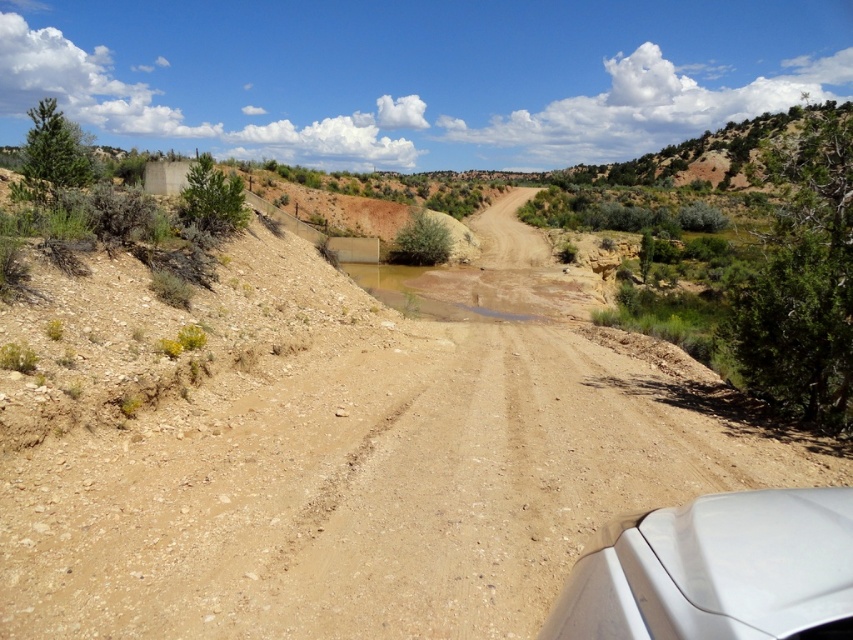
You are a hiker carrying a heavy backpack and need to cross the brown sandy dirt at center and the brown sandy puddle at center. Which one is closer to you?

The brown sandy dirt at center is 19.15 meters away from the brown sandy puddle at center, so the distance between them is 19.15 meters. Therefore, you are equidistant from both the brown sandy dirt at center and the brown sandy puddle at center.